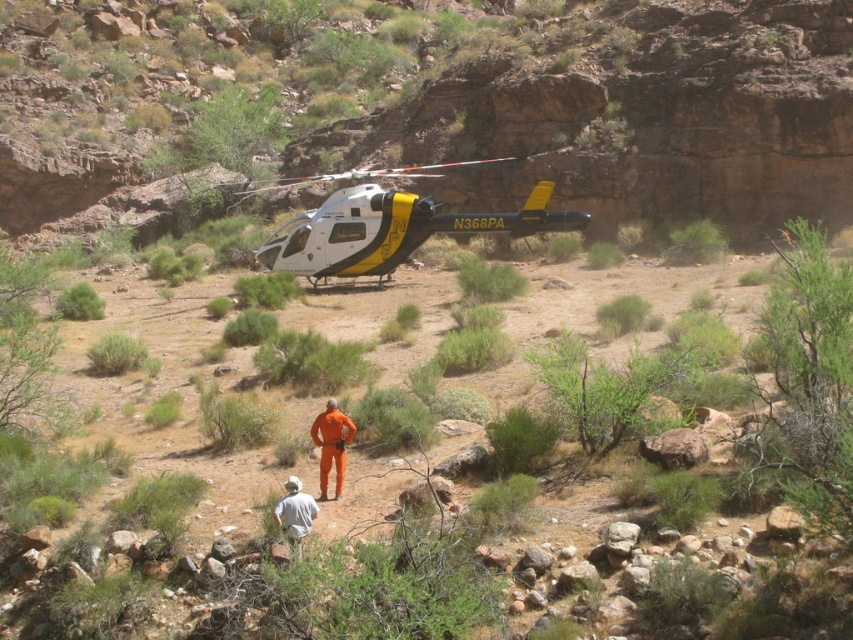
You are a pilot trying to take off from the white glossy helicopter at center. You notice a rustic stone cliff at center blocking your path. Can you safely take off without hitting the cliff?

The white glossy helicopter at center is behind the rustic stone cliff at center, so it can safely take off by moving forward away from the cliff or ascending vertically before moving forward to avoid collision.

You are a rescue worker trying to locate a missing hiker in the desert. You see a rustic stone cliff at center and an orange jumpsuit at center. Which object is taller?

The rustic stone cliff at center is much taller than the orange jumpsuit at center.